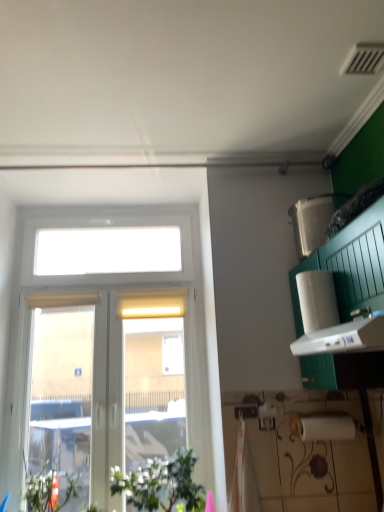
Question: Does white matte paper towel at right have a smaller size compared to white plastic window at left?

Choices:
 (A) yes
 (B) no

Answer: (A)

Question: From a real-world perspective, is white matte paper towel at right located higher than white plastic window at left?

Choices:
 (A) yes
 (B) no

Answer: (A)

Question: From a real-world perspective, is white matte paper towel at right physically below white plastic window at left?

Choices:
 (A) yes
 (B) no

Answer: (B)

Question: Is white matte paper towel at right shorter than white plastic window at left?

Choices:
 (A) yes
 (B) no

Answer: (A)

Question: Is the position of white matte paper towel at right more distant than that of white plastic window at left?

Choices:
 (A) yes
 (B) no

Answer: (B)

Question: Can you confirm if white matte paper towel at right is taller than white plastic window at left?

Choices:
 (A) yes
 (B) no

Answer: (B)

Question: Is white plastic window at left outside of white matte paper towel at right?

Choices:
 (A) yes
 (B) no

Answer: (A)

Question: Is the depth of white plastic window at left less than that of white matte paper towel at right?

Choices:
 (A) yes
 (B) no

Answer: (B)

Question: Is white matte paper towel at right at the back of white plastic window at left?

Choices:
 (A) yes
 (B) no

Answer: (B)

Question: Does white plastic window at left have a greater width compared to white matte paper towel at right?

Choices:
 (A) no
 (B) yes

Answer: (A)

Question: From a real-world perspective, is white plastic window at left located beneath white matte paper towel at right?

Choices:
 (A) yes
 (B) no

Answer: (A)

Question: Is white plastic window at left at the left side of white matte paper towel at right?

Choices:
 (A) no
 (B) yes

Answer: (B)

Question: From a real-world perspective, is white matte paper towel at right over green leafy plant at lower left?

Choices:
 (A) yes
 (B) no

Answer: (A)